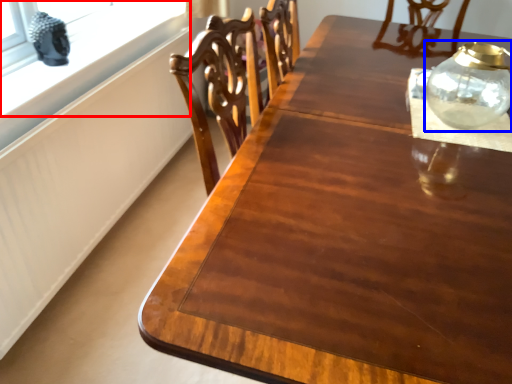
Question: Which object appears closest to the camera in this image, window (highlighted by a red box) or glass vase (highlighted by a blue box)?

Choices:
 (A) window
 (B) glass vase

Answer: (B)